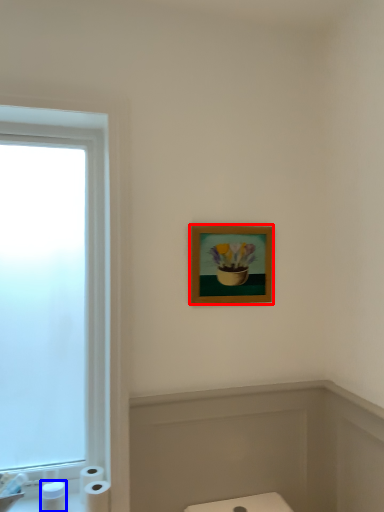
Question: Which object appears farthest to the camera in this image, picture frame (highlighted by a red box) or toiletry (highlighted by a blue box)?

Choices:
 (A) picture frame
 (B) toiletry

Answer: (A)